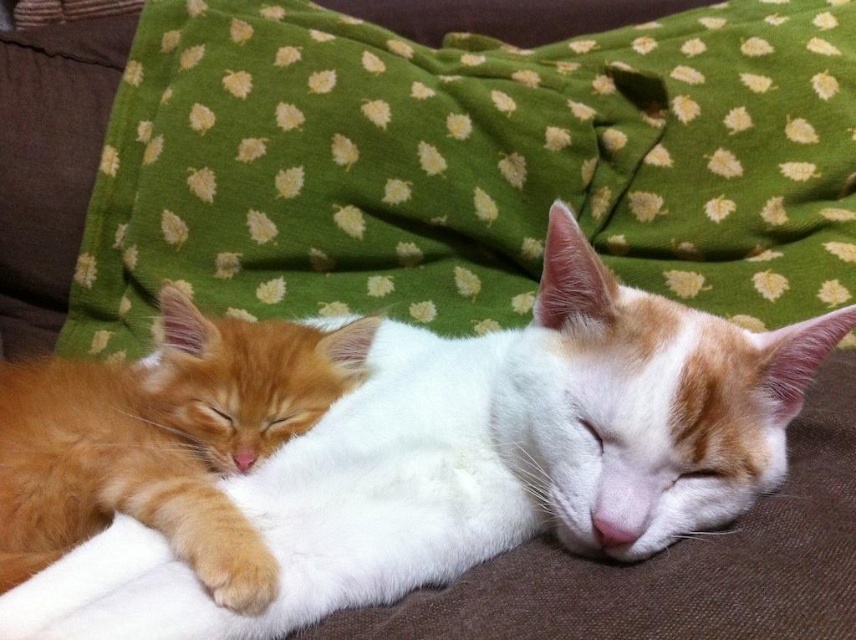
Can you confirm if white soft fur cat at center is positioned below fluffy orange cat at center?

Actually, white soft fur cat at center is above fluffy orange cat at center.

Is white soft fur cat at center positioned at the back of fluffy orange cat at center?

No, white soft fur cat at center is in front of fluffy orange cat at center.

Is point (634, 438) closer to camera compared to point (134, 458)?

That is True.

The image size is (856, 640). I want to click on white soft fur cat at center, so click(477, 460).